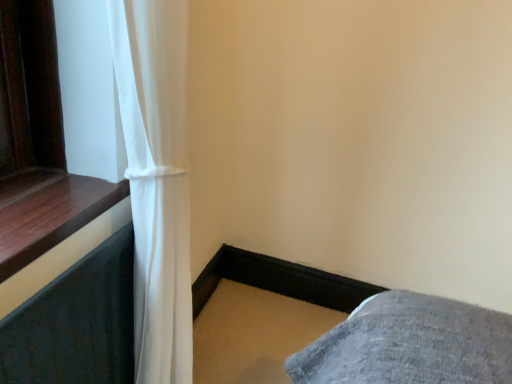
The image size is (512, 384). Identify the location of free spot above wooden at left (from a real-world perspective). (47, 187).